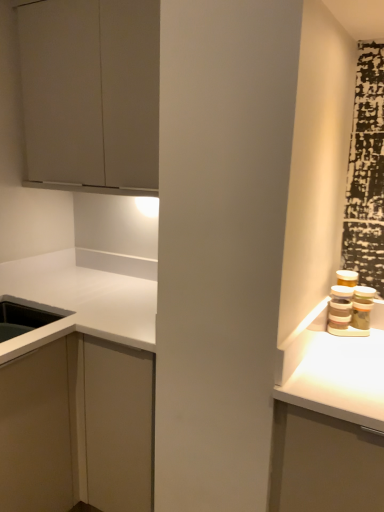
Question: Does white matte cabinet at lower left, the 1th cabinetry positioned from the bottom, have a larger size compared to matte gray cabinet at upper left, marked as the first cabinetry in a top-to-bottom arrangement?

Choices:
 (A) no
 (B) yes

Answer: (B)

Question: Considering the relative sizes of white matte cabinet at lower left, arranged as the 2th cabinetry when viewed from the top, and matte gray cabinet at upper left, marked as the first cabinetry in a top-to-bottom arrangement, in the image provided, is white matte cabinet at lower left, arranged as the 2th cabinetry when viewed from the top, wider than matte gray cabinet at upper left, marked as the first cabinetry in a top-to-bottom arrangement,?

Choices:
 (A) no
 (B) yes

Answer: (B)

Question: From the image's perspective, is white matte cabinet at lower left, the 1th cabinetry positioned from the bottom, located beneath matte gray cabinet at upper left, marked as the first cabinetry in a top-to-bottom arrangement?

Choices:
 (A) yes
 (B) no

Answer: (A)

Question: Could you tell me if white matte cabinet at lower left, the 1th cabinetry positioned from the bottom, is turned towards matte gray cabinet at upper left, marked as the first cabinetry in a top-to-bottom arrangement?

Choices:
 (A) yes
 (B) no

Answer: (B)

Question: Would you say white matte cabinet at lower left, arranged as the 2th cabinetry when viewed from the top, is outside matte gray cabinet at upper left, marked as the first cabinetry in a top-to-bottom arrangement?

Choices:
 (A) no
 (B) yes

Answer: (B)

Question: Is matte gray cabinet at upper left, marked as the first cabinetry in a top-to-bottom arrangement, inside white matte cabinet at lower left, arranged as the 2th cabinetry when viewed from the top?

Choices:
 (A) yes
 (B) no

Answer: (B)

Question: From a real-world perspective, is matte gray cabinet at upper left, the second cabinetry ordered from the bottom, physically below white matte cabinet at lower left, the 1th cabinetry positioned from the bottom?

Choices:
 (A) no
 (B) yes

Answer: (A)

Question: Does matte gray cabinet at upper left, marked as the first cabinetry in a top-to-bottom arrangement, come behind white matte cabinet at lower left, the 1th cabinetry positioned from the bottom?

Choices:
 (A) no
 (B) yes

Answer: (B)

Question: Is white matte cabinet at lower left, the 1th cabinetry positioned from the bottom, at the back of matte gray cabinet at upper left, marked as the first cabinetry in a top-to-bottom arrangement?

Choices:
 (A) yes
 (B) no

Answer: (B)

Question: Is matte gray cabinet at upper left, the second cabinetry ordered from the bottom, taller than white matte cabinet at lower left, arranged as the 2th cabinetry when viewed from the top?

Choices:
 (A) no
 (B) yes

Answer: (A)

Question: Are matte gray cabinet at upper left, the second cabinetry ordered from the bottom, and white matte cabinet at lower left, the 1th cabinetry positioned from the bottom, far apart?

Choices:
 (A) yes
 (B) no

Answer: (B)

Question: Considering the relative positions of matte gray cabinet at upper left, marked as the first cabinetry in a top-to-bottom arrangement, and white matte cabinet at lower left, arranged as the 2th cabinetry when viewed from the top, in the image provided, is matte gray cabinet at upper left, marked as the first cabinetry in a top-to-bottom arrangement, to the right of white matte cabinet at lower left, arranged as the 2th cabinetry when viewed from the top, from the viewer's perspective?

Choices:
 (A) no
 (B) yes

Answer: (B)

Question: In the image, is matte gray cabinet at upper left, the second cabinetry ordered from the bottom, positioned in front of or behind white matte cabinet at lower left, arranged as the 2th cabinetry when viewed from the top?

Choices:
 (A) front
 (B) behind

Answer: (B)